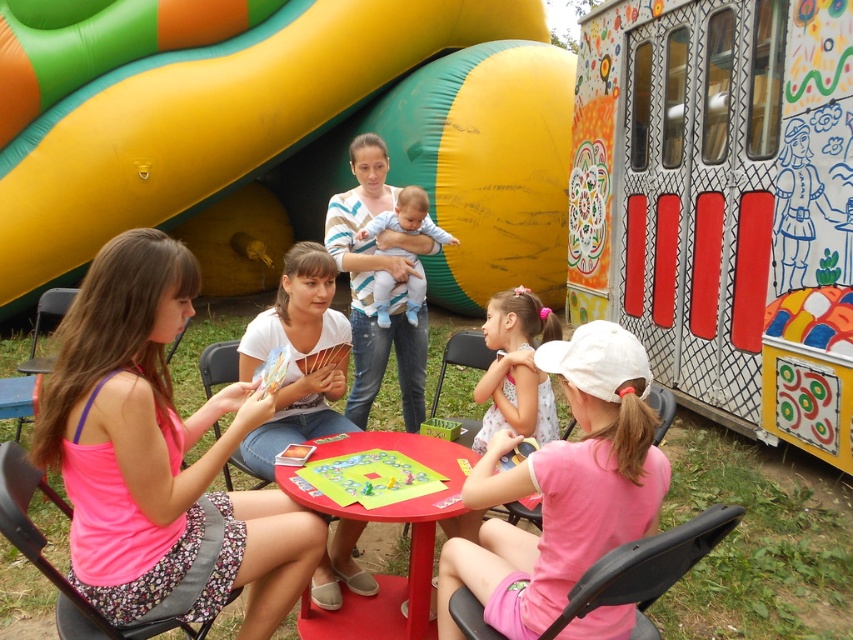
You are a photographer trying to capture a closeup of the smooth plastic table at center without including the pink fabric dress at lower center in the frame. Given their relative sizes, is this possible?

The pink fabric dress at lower center has a lesser width compared to the smooth plastic table at center. Since the dress is narrower, it might be possible to position the camera in a way that only the table is captured, avoiding the dress by framing around its smaller width.